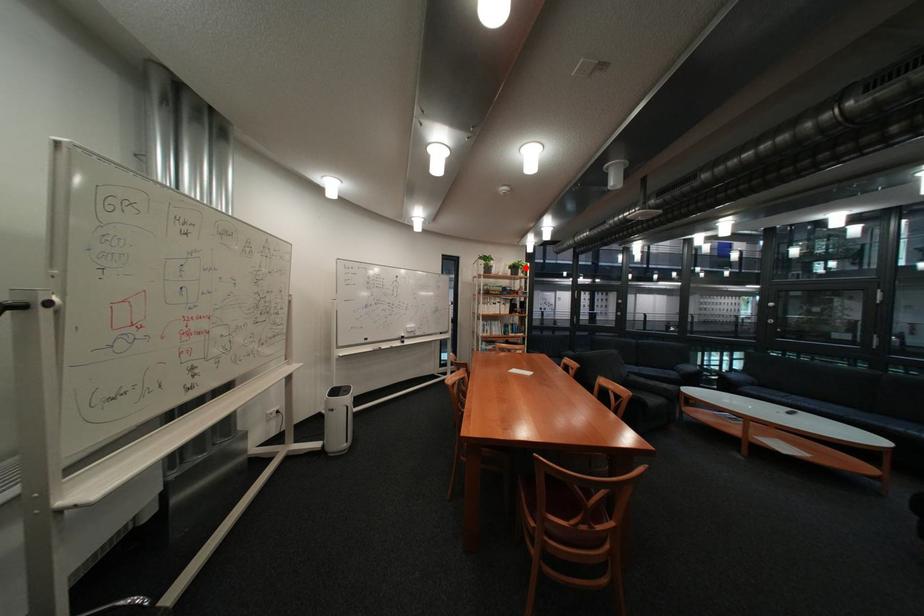
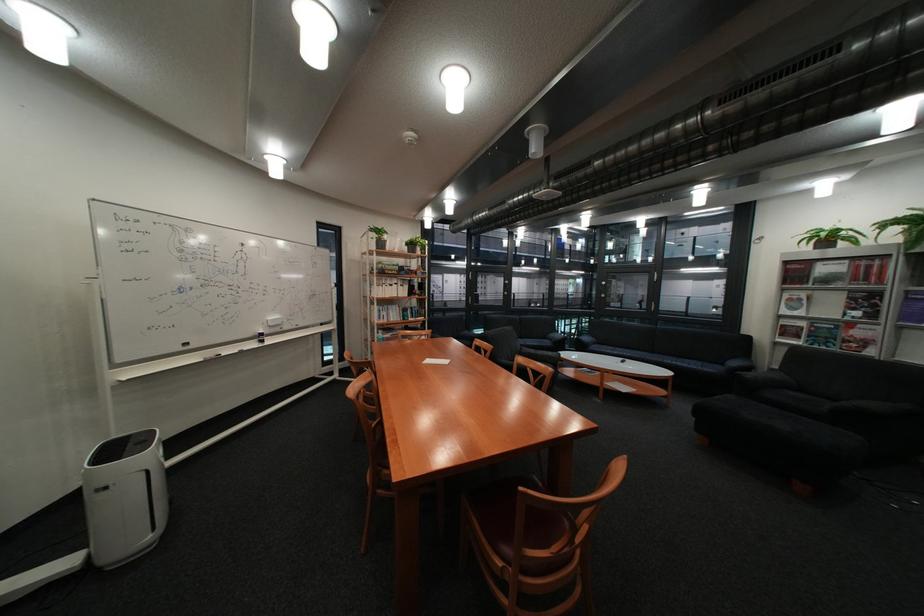
The point at the highlighted location is marked in the first image. Where is the corresponding point in the second image?

(421, 245)